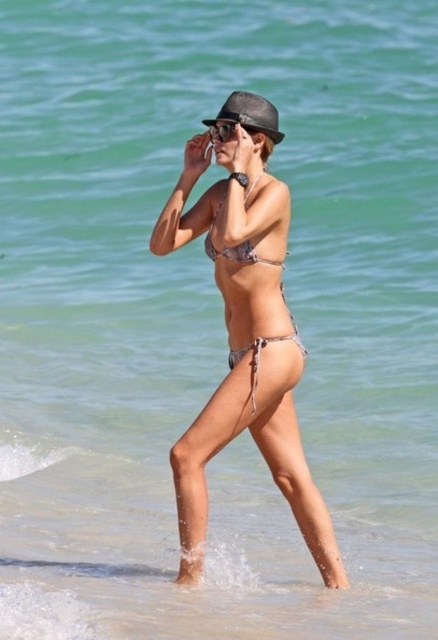
Between metallic silver bikini at center and printed fabric bikini top at center, which one is positioned higher?

printed fabric bikini top at center is above.

Between metallic silver bikini at center and printed fabric bikini top at center, which one is positioned lower?

metallic silver bikini at center is lower down.

Between point (198, 490) and point (208, 237), which one is positioned in front?

Positioned in front is point (198, 490).

The height and width of the screenshot is (640, 438). What are the coordinates of `metallic silver bikini at center` in the screenshot? It's located at (244, 340).

I want to click on printed fabric bikini top at center, so click(236, 252).

Does point (243, 253) lie behind point (230, 131)?

That is False.

Identify the location of printed fabric bikini top at center. 236,252.

Who is lower down, metallic silver bikini at center or black matte sunglasses at center?

metallic silver bikini at center is lower down.

Which of these two, metallic silver bikini at center or black matte sunglasses at center, stands shorter?

black matte sunglasses at center is shorter.

At what (x,y) coordinates should I click in order to perform the action: click on metallic silver bikini at center. Please return your answer as a coordinate pair (x, y). Image resolution: width=438 pixels, height=640 pixels. Looking at the image, I should click on tap(244, 340).